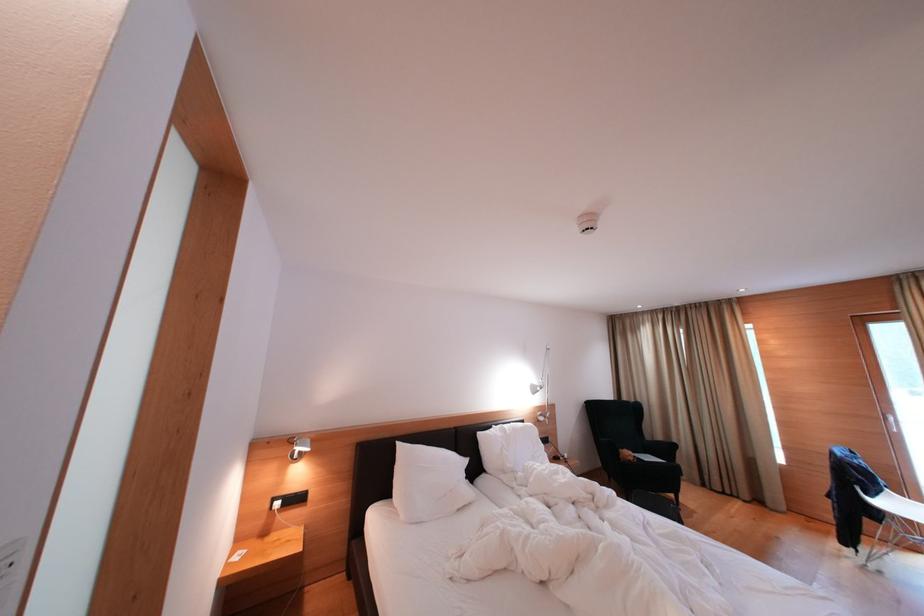
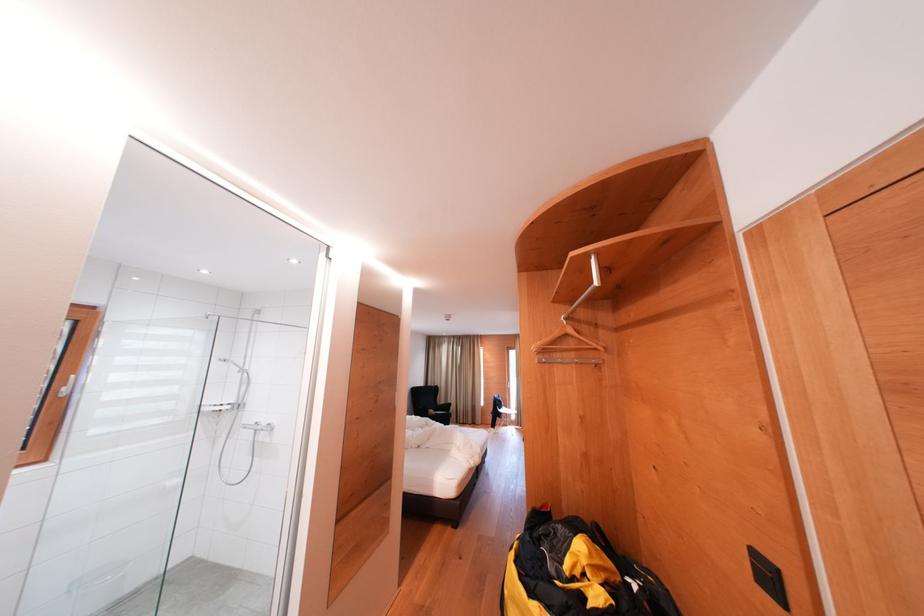
In the second image, find the point that corresponds to point 635,458 in the first image.

(439, 416)